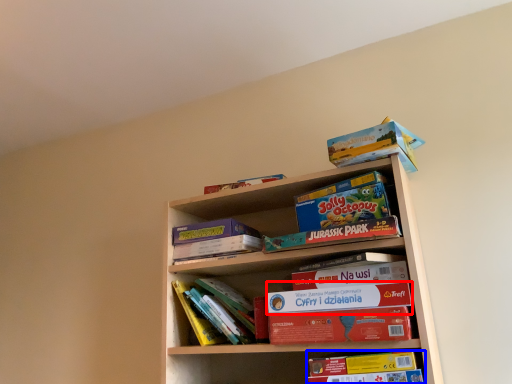
Question: Which object is further to the camera taking this photo, paperback book (highlighted by a red box) or book (highlighted by a blue box)?

Choices:
 (A) paperback book
 (B) book

Answer: (A)